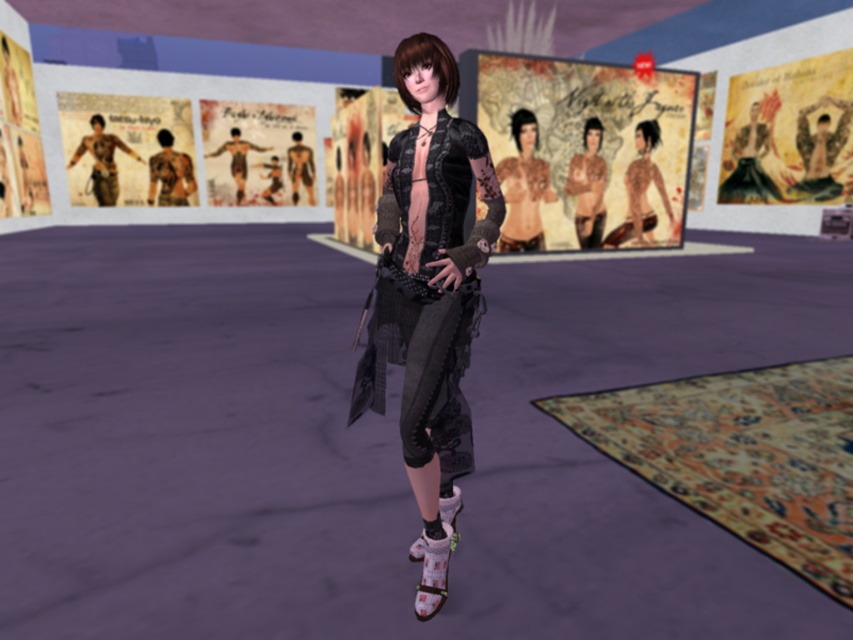
Who is shorter, matte paper poster at upper center or matte black torso at center?

matte black torso at center is shorter.

Does point (538, 76) lie behind point (585, 131)?

Yes, point (538, 76) is farther from viewer.

Does point (660, 189) come behind point (596, 218)?

No, (660, 189) is in front of (596, 218).

I want to click on matte paper poster at upper center, so click(583, 148).

Is matte black top at center below matte black dress at center?

Correct, matte black top at center is located below matte black dress at center.

Does matte black top at center have a greater height compared to matte black dress at center?

In fact, matte black top at center may be shorter than matte black dress at center.

Which is in front, point (502, 173) or point (744, 147)?

Point (502, 173) is more forward.

This screenshot has width=853, height=640. I want to click on matte black top at center, so click(523, 188).

Can you confirm if matte paper poster at upper center is positioned below matte black dress at center?

Yes, matte paper poster at upper center is below matte black dress at center.

Between point (479, 106) and point (766, 134), which one is positioned behind?

The point (766, 134) is more distant.

Find the location of a particular element. The width and height of the screenshot is (853, 640). matte paper poster at upper center is located at coordinates (583, 148).